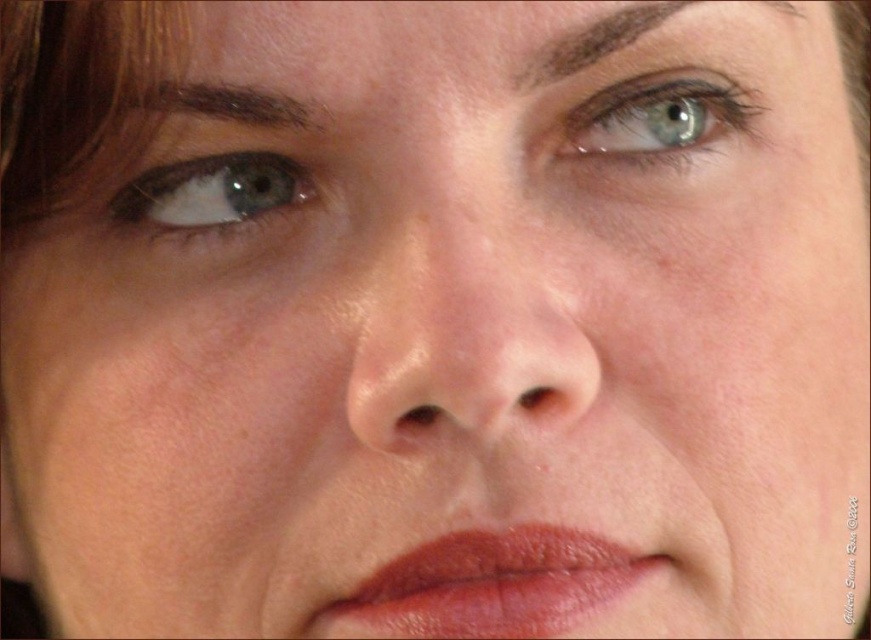
Question: Which object is closer to the camera taking this photo?

Choices:
 (A) dark brown hair at upper center
 (B) brown matte freckle at nose
 (C) dark brown eyebrow at upper left

Answer: (B)

Question: From the image, what is the correct spatial relationship of smooth skin nose at center in relation to dark brown hair at upper center?

Choices:
 (A) right
 (B) left

Answer: (B)

Question: Can you confirm if blue glossy eye at left is positioned to the right of dark brown hair at upper center?

Choices:
 (A) no
 (B) yes

Answer: (A)

Question: Which is farther from the matte pink lips at center?

Choices:
 (A) brown matte freckle at nose
 (B) blue glossy eye at left
 (C) blue glossy eye at upper center

Answer: (C)

Question: Which point is farther to the camera?

Choices:
 (A) brown matte freckle at nose
 (B) smooth skin nose at center

Answer: (A)

Question: Can you confirm if smooth skin nose at center is bigger than brown matte freckle at nose?

Choices:
 (A) no
 (B) yes

Answer: (B)